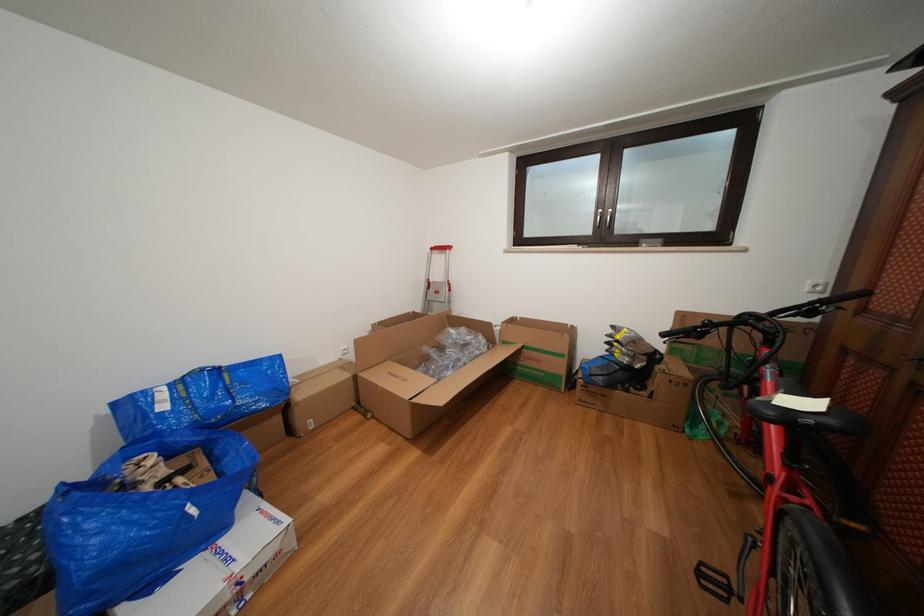
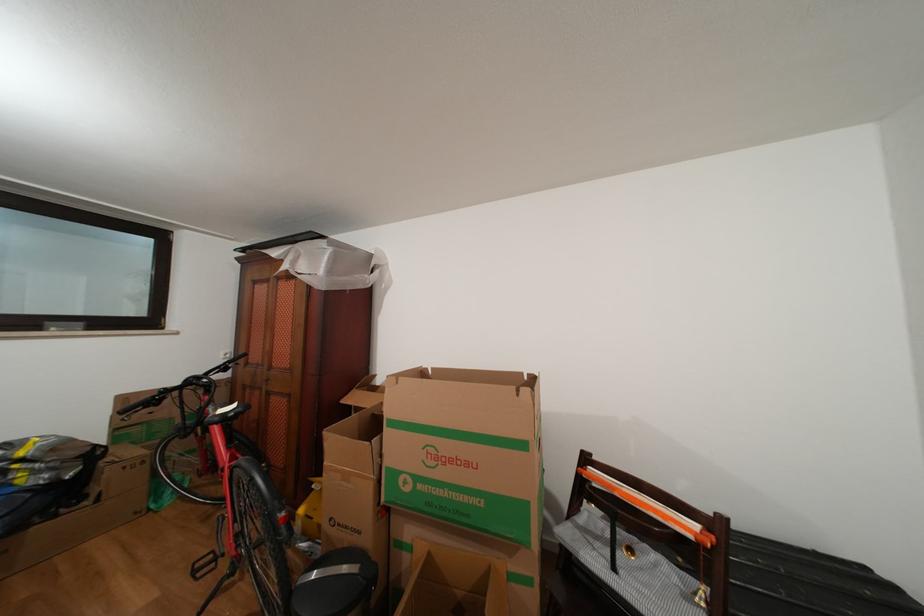
Question: Based on the continuous images, in which direction is the camera rotating? Reply with the corresponding letter.

Choices:
 (A) Left
 (B) Right
 (C) Up
 (D) Down

Answer: (B)